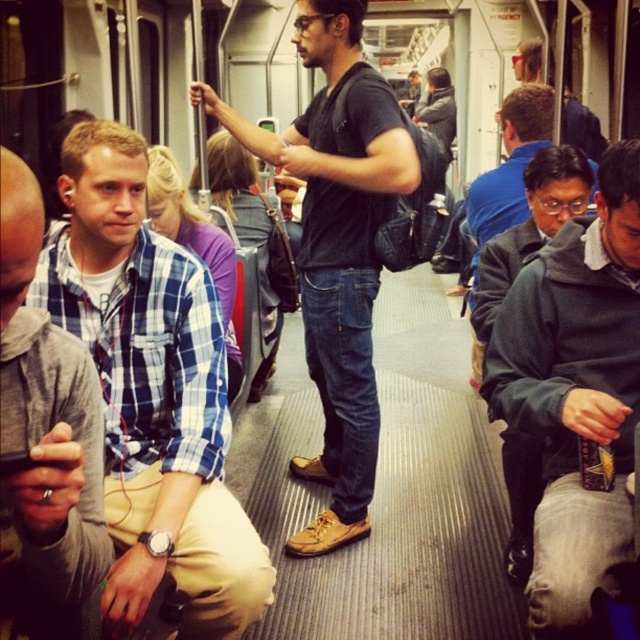
Question: Does dark gray t-shirt at center appear on the left side of matte black backpack at center?

Choices:
 (A) no
 (B) yes

Answer: (B)

Question: Among these objects, which one is nearest to the camera?

Choices:
 (A) matte black backpack at center
 (B) plaid cotton shirt at center

Answer: (B)

Question: Is dark gray t-shirt at center to the left of matte black backpack at center from the viewer's perspective?

Choices:
 (A) yes
 (B) no

Answer: (A)

Question: Which point is closer to the camera?

Choices:
 (A) (364, 436)
 (B) (161, 202)
 (C) (531, 48)

Answer: (B)

Question: Is the position of blue plaid shirt at center less distant than that of dark gray t-shirt at center?

Choices:
 (A) yes
 (B) no

Answer: (A)

Question: Which of these objects is positioned farthest from the dark gray t-shirt at center?

Choices:
 (A) matte black backpack at center
 (B) plaid cotton shirt at left
 (C) plaid cotton shirt at center
 (D) blue plaid shirt at center

Answer: (A)